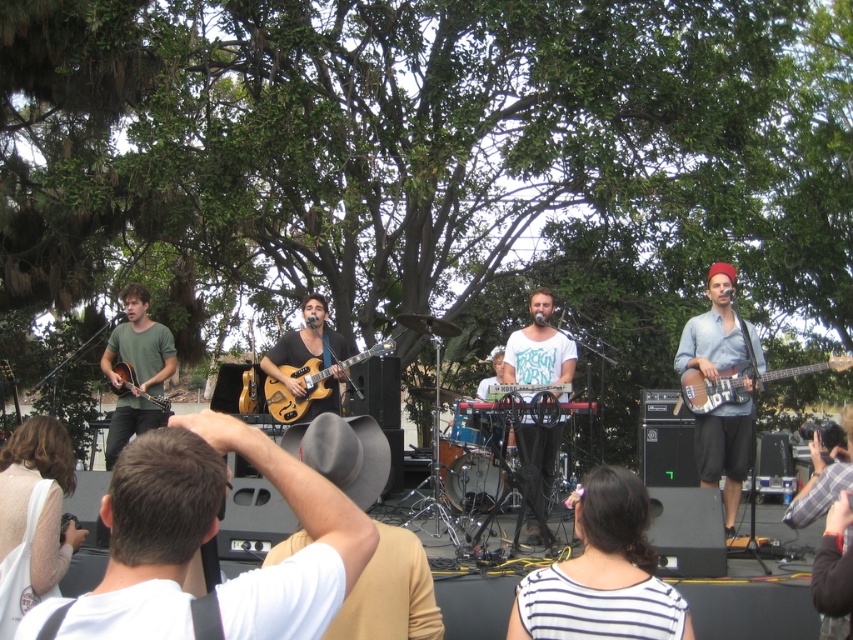
Question: Observing the image, what is the correct spatial positioning of matte brown electric guitar at center in reference to matte brown acoustic guitar at left?

Choices:
 (A) right
 (B) left

Answer: (A)

Question: Which of the following is the closest to the observer?

Choices:
 (A) matte green shirt at left
 (B) white matte keyboard at center

Answer: (B)

Question: Which point is farther to the camera?

Choices:
 (A) white lace shirt at lower left
 (B) wooden electric bass at right

Answer: (B)

Question: Does matte green shirt at left have a greater width compared to matte brown electric guitar at center?

Choices:
 (A) yes
 (B) no

Answer: (A)

Question: Can you confirm if white matte hat at center is wider than denim shirt at right?

Choices:
 (A) no
 (B) yes

Answer: (B)

Question: Which of the following is the closest to the observer?

Choices:
 (A) (113, 374)
 (B) (561, 337)

Answer: (B)